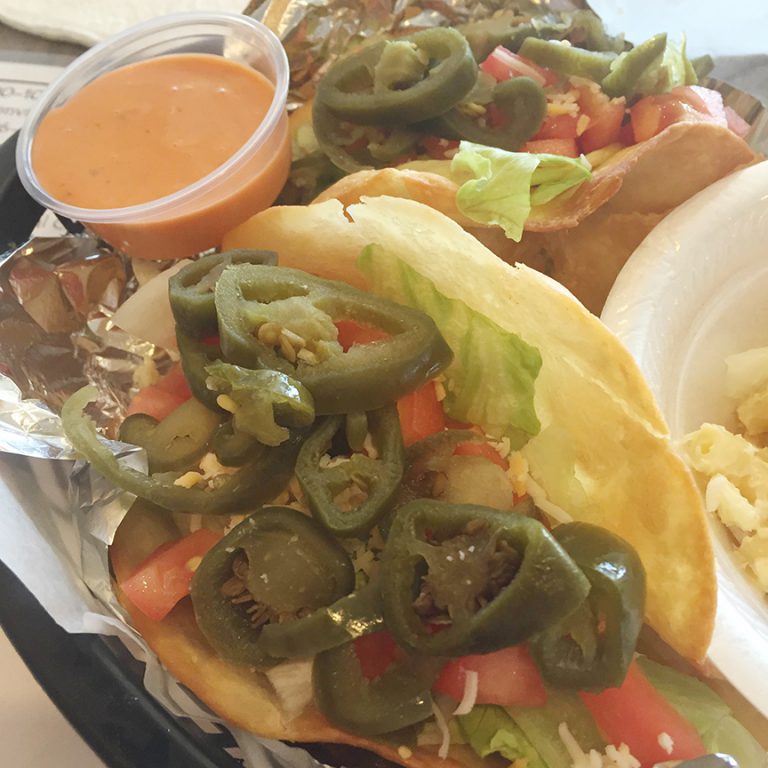
Identify the location of plate. 90,24.